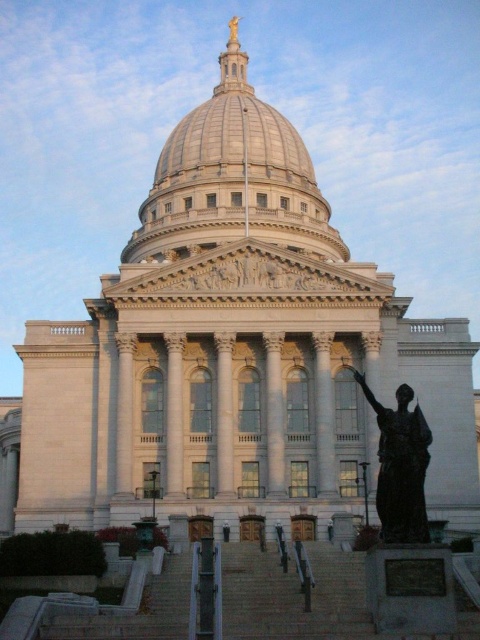
You are standing in front of the Wisconsin State Capitol building and want to locate a specific point on the building. The point is labeled as point (x=232, y=179). Based on the image, where exactly is this point located?

The point (x=232, y=179) is located on the shiny metallic dome at center.

You are standing in front of the Wisconsin State Capitol building and want to take a photo of the shiny metallic dome at center. If your camera has a maximum focus range of 80 meters, will you be able to capture the dome clearly?

The shiny metallic dome at center is 82.83 meters away from the viewer. Since the camera can only focus up to 80 meters, it won not be able to capture the dome clearly.